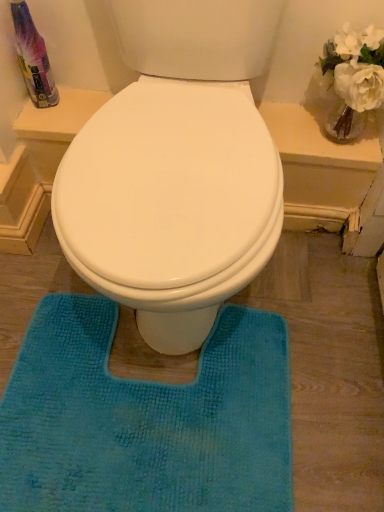
Question: Does translucent plastic spray bottle at upper left have a larger size compared to teal plush bath mat at center?

Choices:
 (A) no
 (B) yes

Answer: (A)

Question: Does translucent plastic spray bottle at upper left have a lesser width compared to teal plush bath mat at center?

Choices:
 (A) no
 (B) yes

Answer: (B)

Question: Can we say translucent plastic spray bottle at upper left lies outside teal plush bath mat at center?

Choices:
 (A) yes
 (B) no

Answer: (A)

Question: Can you confirm if translucent plastic spray bottle at upper left is shorter than teal plush bath mat at center?

Choices:
 (A) no
 (B) yes

Answer: (A)

Question: Is translucent plastic spray bottle at upper left next to teal plush bath mat at center and touching it?

Choices:
 (A) yes
 (B) no

Answer: (B)

Question: Is teal plush bath mat at center completely or partially inside translucent plastic spray bottle at upper left?

Choices:
 (A) no
 (B) yes

Answer: (A)

Question: Is teal plush bath mat at center located outside translucent plastic spray bottle at upper left?

Choices:
 (A) no
 (B) yes

Answer: (B)

Question: Is teal plush bath mat at center in front of translucent plastic spray bottle at upper left?

Choices:
 (A) no
 (B) yes

Answer: (B)

Question: Is teal plush bath mat at center thinner than translucent plastic spray bottle at upper left?

Choices:
 (A) yes
 (B) no

Answer: (B)

Question: Is teal plush bath mat at center placed right next to translucent plastic spray bottle at upper left?

Choices:
 (A) yes
 (B) no

Answer: (B)

Question: Considering the relative sizes of teal plush bath mat at center and translucent plastic spray bottle at upper left in the image provided, is teal plush bath mat at center bigger than translucent plastic spray bottle at upper left?

Choices:
 (A) no
 (B) yes

Answer: (B)

Question: Is teal plush bath mat at center further to the viewer compared to translucent plastic spray bottle at upper left?

Choices:
 (A) yes
 (B) no

Answer: (B)

Question: In terms of height, does teal plush bath mat at center look taller or shorter compared to translucent plastic spray bottle at upper left?

Choices:
 (A) tall
 (B) short

Answer: (B)